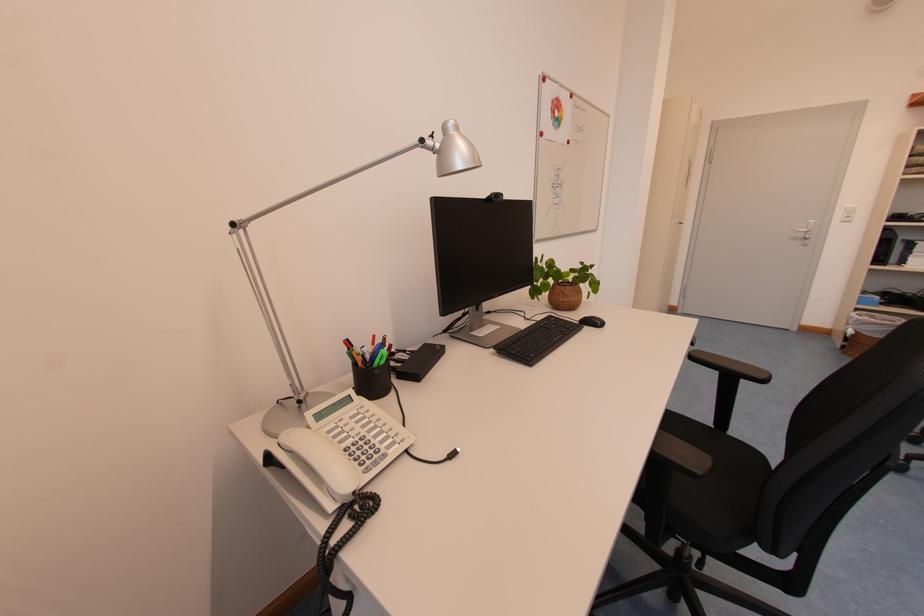
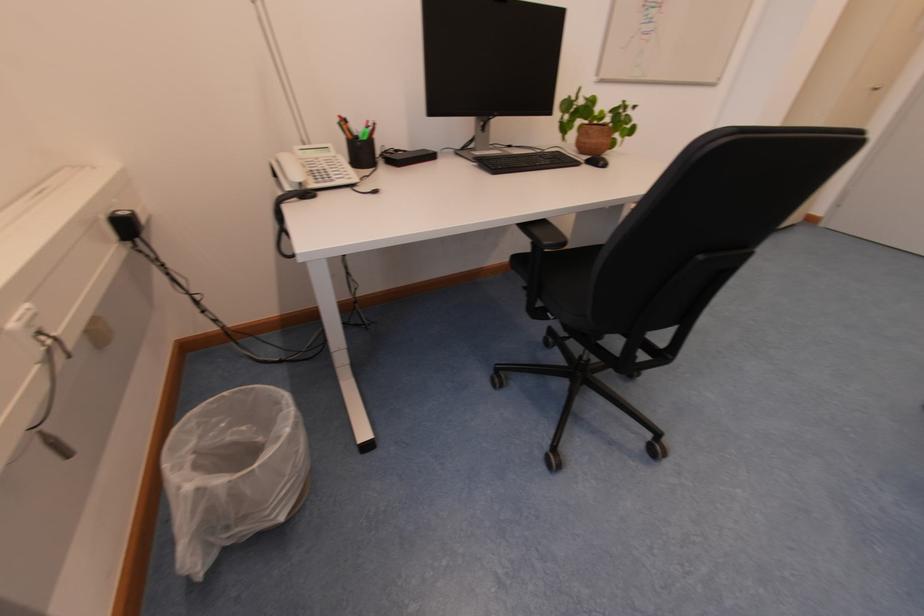
Where in the second image is the point corresponding to point 339,509 from the first image?

(296, 191)